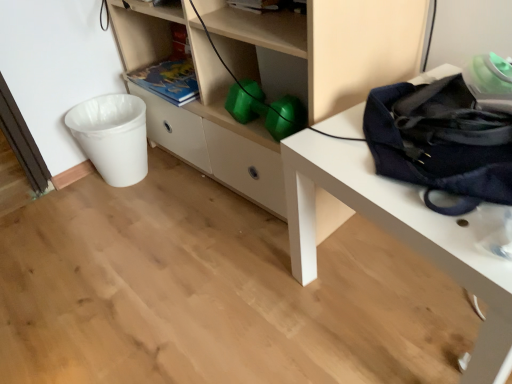
At what (x,y) coordinates should I click in order to perform the action: click on free point above matte green book at center (from a real-world perspective). Please return your answer as a coordinate pair (x, y). Looking at the image, I should click on (170, 70).